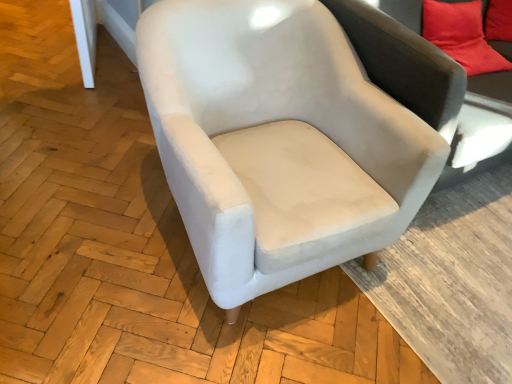
The height and width of the screenshot is (384, 512). Find the location of `free spot in front of suede-like beige armchair at center`. free spot in front of suede-like beige armchair at center is located at coordinates (209, 337).